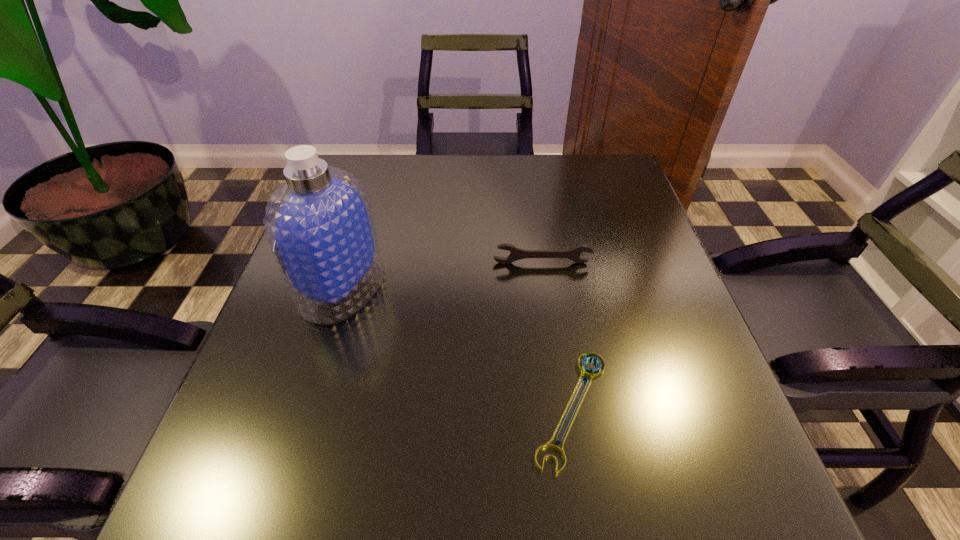
This screenshot has height=540, width=960. Find the location of `object positioned at the left edge`. object positioned at the left edge is located at coordinates (319, 224).

Where is `free space at the far edge of the desktop`? Image resolution: width=960 pixels, height=540 pixels. free space at the far edge of the desktop is located at coordinates pos(483,160).

Where is `free region at the near edge`? free region at the near edge is located at coordinates (614, 491).

You are a GUI agent. You are given a task and a screenshot of the screen. Output one action in this format:
    pyautogui.click(x=<x>, y=<y>)
    Task: Click on the vacant space at the left edge of the desktop
    The width and height of the screenshot is (960, 540).
    Given the screenshot: What is the action you would take?
    pyautogui.click(x=271, y=346)

In the image, there is a desktop. Identify the location of vacant space at the right edge. (657, 420).

This screenshot has width=960, height=540. I want to click on blank space at the far right corner of the desktop, so click(620, 188).

Locate an element on the screen. The image size is (960, 540). vacant region between the farther wrench and the cleansing agent is located at coordinates (443, 275).

Find the location of `vacant area that lies between the nearer wrench and the leftmost object`. vacant area that lies between the nearer wrench and the leftmost object is located at coordinates (457, 348).

The width and height of the screenshot is (960, 540). I want to click on vacant point located between the leftmost object and the second shortest object, so click(443, 275).

Image resolution: width=960 pixels, height=540 pixels. In order to click on free space between the second tallest object and the shorter wrench in this screenshot , I will do `click(557, 336)`.